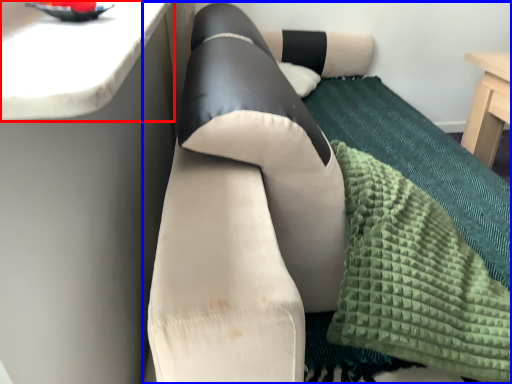
Question: Which object is further to the camera taking this photo, counter top (highlighted by a red box) or studio couch (highlighted by a blue box)?

Choices:
 (A) counter top
 (B) studio couch

Answer: (B)